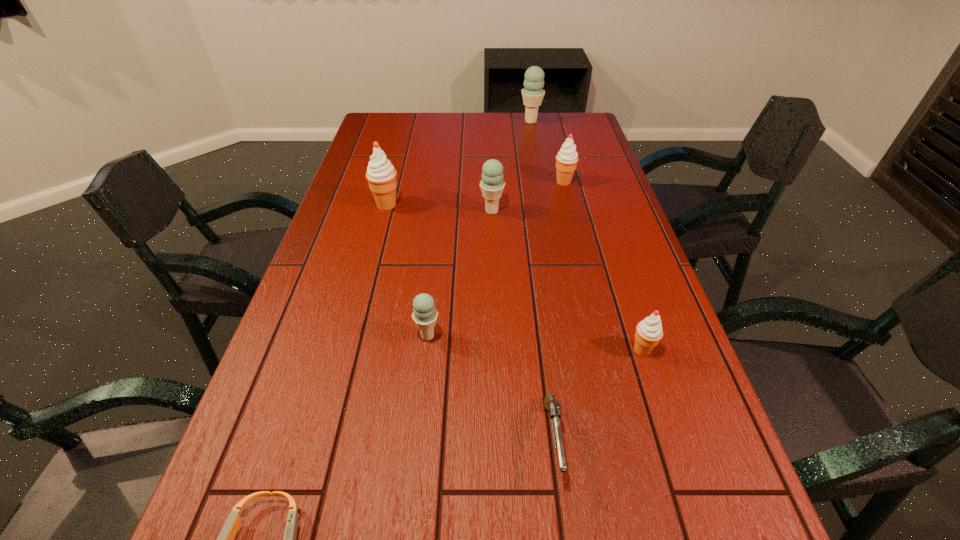
Locate an element on the screen. vacant area situated 0.050m aiming along the barrel of the fourth object from right to left is located at coordinates (563, 520).

I want to click on object that is at the far edge, so click(533, 94).

This screenshot has height=540, width=960. I want to click on object that is at the left edge, so click(x=381, y=175).

In the image, there is a desktop. Find the location of `vacant space at the far edge`. vacant space at the far edge is located at coordinates (441, 132).

Where is `free location at the left edge of the desktop`? This screenshot has width=960, height=540. free location at the left edge of the desktop is located at coordinates (208, 523).

Find the location of a particular element. free spot at the right edge of the desktop is located at coordinates (588, 181).

The image size is (960, 540). I want to click on free space at the far left corner, so click(x=381, y=128).

Locate an element on the screen. This screenshot has width=960, height=540. free space between the fifth object from left to right and the leftmost red icecream is located at coordinates (469, 322).

You are a GUI agent. You are given a task and a screenshot of the screen. Output one action in this format:
    pyautogui.click(x=<x>, y=<y>)
    Task: Click on the free spot between the second farthest red icecream and the third ice cream from left to right
    The width and height of the screenshot is (960, 540).
    Given the screenshot: What is the action you would take?
    pyautogui.click(x=439, y=208)

The width and height of the screenshot is (960, 540). I want to click on free space between the smallest red icecream and the nearest blue ice cream, so (x=535, y=343).